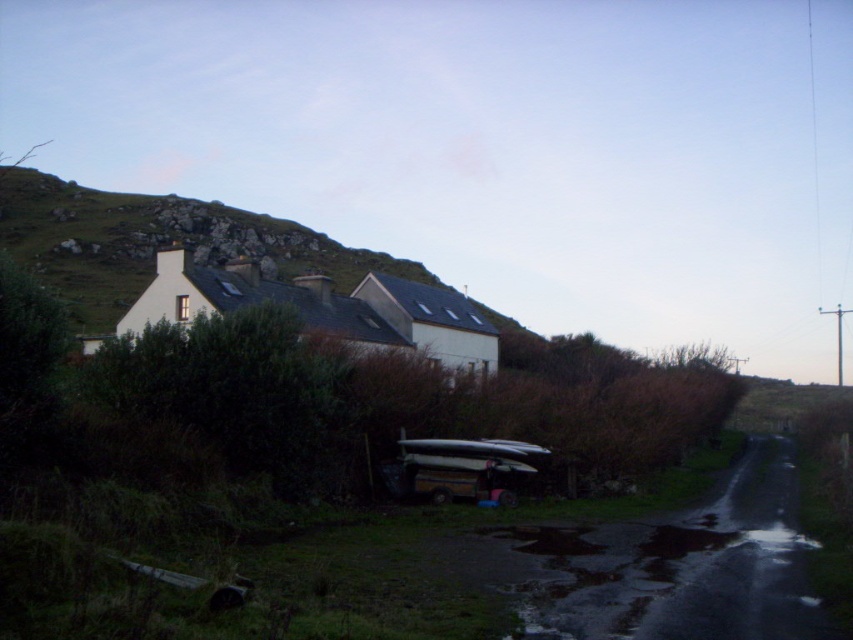
Is point (257, 243) positioned after point (413, 460)?

Yes.

Which is above, green grassy hillside at upper left or metallic silver canoe at center?

green grassy hillside at upper left is above.

Which is in front, point (131, 252) or point (502, 499)?

Point (502, 499) is in front.

The height and width of the screenshot is (640, 853). Find the location of `green grassy hillside at upper left`. green grassy hillside at upper left is located at coordinates (157, 243).